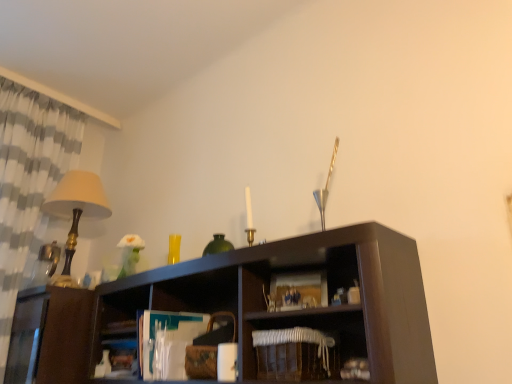
What are the coordinates of `white woven basket at lower center` in the screenshot? It's located at (309, 327).

Where is `curtain behind the white woven basket at lower center`? This screenshot has height=384, width=512. curtain behind the white woven basket at lower center is located at coordinates (29, 185).

In the scene shown: Considering the positions of objects white woven basket at lower center and white checkered fabric at left in the image provided, who is more to the right, white woven basket at lower center or white checkered fabric at left?

Positioned to the right is white woven basket at lower center.

Considering the relative positions of white woven basket at lower center and white checkered fabric at left in the image provided, is white woven basket at lower center in front of white checkered fabric at left?

Yes, it is in front of white checkered fabric at left.

Is matte gold table lamp at left directly adjacent to white checkered fabric at left?

There is a gap between matte gold table lamp at left and white checkered fabric at left.

Which of these two, matte gold table lamp at left or white checkered fabric at left, is smaller?

Smaller between the two is matte gold table lamp at left.

Which is less distant, (65,281) or (42,149)?

The point (65,281) is more forward.

Is matte gold table lamp at left facing towards white checkered fabric at left?

No.

From their relative heights in the image, would you say white checkered fabric at left is taller or shorter than white woven basket at lower center?

white checkered fabric at left is taller than white woven basket at lower center.

Is white checkered fabric at left facing towards white woven basket at lower center?

Yes, white checkered fabric at left is oriented towards white woven basket at lower center.

In the scene shown: Which is correct: white checkered fabric at left is inside white woven basket at lower center, or outside of it?

white checkered fabric at left is not enclosed by white woven basket at lower center.

From a real-world perspective, is white woven basket at lower center positioned under matte gold table lamp at left based on gravity?

Yes, from a real-world perspective, white woven basket at lower center is under matte gold table lamp at left.

Does white woven basket at lower center come in front of matte gold table lamp at left?

Yes, the depth of white woven basket at lower center is less than that of matte gold table lamp at left.

Considering the sizes of objects white woven basket at lower center and matte gold table lamp at left in the image provided, who is smaller, white woven basket at lower center or matte gold table lamp at left?

white woven basket at lower center.

Considering the positions of objects matte gold table lamp at left and white woven basket at lower center in the image provided, who is more to the left, matte gold table lamp at left or white woven basket at lower center?

matte gold table lamp at left.

Which is closer to the camera, (65, 252) or (349, 338)?

The point (349, 338) is closer.

In the scene shown: Are matte gold table lamp at left and white woven basket at lower center far apart?

That's right, there is a large distance between matte gold table lamp at left and white woven basket at lower center.

Can white woven basket at lower center be found inside matte gold table lamp at left?

No, matte gold table lamp at left does not contain white woven basket at lower center.

Which is behind, point (7, 123) or point (70, 229)?

Positioned behind is point (7, 123).

From a real-world perspective, is white checkered fabric at left physically above matte gold table lamp at left?

Yes, from a real-world perspective, white checkered fabric at left is above matte gold table lamp at left.

Which of these two, white checkered fabric at left or matte gold table lamp at left, stands shorter?

matte gold table lamp at left.

From the image's perspective, which one is positioned lower, white checkered fabric at left or matte gold table lamp at left?

matte gold table lamp at left, from the image's perspective.

This screenshot has height=384, width=512. I want to click on shelf on the right of white checkered fabric at left, so click(309, 327).

Identify the location of curtain above the matte gold table lamp at left (from the image's perspective). (29, 185).

Looking at the image, which one is located further to white woven basket at lower center, white checkered fabric at left or matte gold table lamp at left?

white checkered fabric at left is positioned further to the anchor white woven basket at lower center.

Which object lies further to the anchor point white checkered fabric at left, white woven basket at lower center or matte gold table lamp at left?

white woven basket at lower center lies further to white checkered fabric at left than the other object.

Estimate the real-world distances between objects in this image. Which object is further from matte gold table lamp at left, white checkered fabric at left or white woven basket at lower center?

Among the two, white woven basket at lower center is located further to matte gold table lamp at left.

Based on their spatial positions, is matte gold table lamp at left or white woven basket at lower center further from white checkered fabric at left?

white woven basket at lower center.

Which object lies nearer to the anchor point matte gold table lamp at left, white woven basket at lower center or white checkered fabric at left?

Among the two, white checkered fabric at left is located nearer to matte gold table lamp at left.

Which object lies nearer to the anchor point white woven basket at lower center, matte gold table lamp at left or white checkered fabric at left?

The object closer to white woven basket at lower center is matte gold table lamp at left.

The image size is (512, 384). I want to click on table lamp between white checkered fabric at left and white woven basket at lower center in the horizontal direction, so click(x=76, y=211).